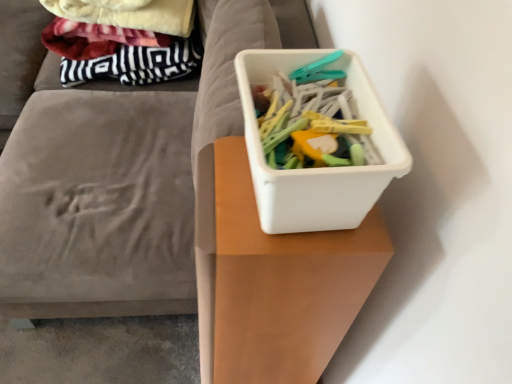
Identify the location of white plastic container at center. (118, 182).

The height and width of the screenshot is (384, 512). Describe the element at coordinates (283, 283) in the screenshot. I see `white plastic container at upper right` at that location.

Locate an element on the screen. The width and height of the screenshot is (512, 384). white plastic container at center is located at coordinates (118, 182).

How many degrees apart are the facing directions of white plastic container at center and white plastic container at center?

The angular difference between white plastic container at center and white plastic container at center is 0.000945 degrees.

Consider the image. Considering the relative positions of white plastic container at center and white plastic container at center in the image provided, is white plastic container at center to the left of white plastic container at center from the viewer's perspective?

In fact, white plastic container at center is to the right of white plastic container at center.

Looking at this image, from a real-world perspective, who is located higher, white plastic container at center or white plastic container at center?

white plastic container at center, from a real-world perspective.

Image resolution: width=512 pixels, height=384 pixels. Find the location of `furniture above the white plastic container at center (from the image's perspective)`. furniture above the white plastic container at center (from the image's perspective) is located at coordinates (118, 182).

Is white plastic container at center shorter than white plastic container at upper right?

Indeed, white plastic container at center has a lesser height compared to white plastic container at upper right.

You are a GUI agent. You are given a task and a screenshot of the screen. Output one action in this format:
    pyautogui.click(x=<x>, y=<y>)
    Task: Click on the table that appears above the white plastic container at center (from a real-world perspective)
    The width and height of the screenshot is (512, 384).
    Given the screenshot: What is the action you would take?
    pyautogui.click(x=283, y=283)

How many degrees apart are the facing directions of white plastic container at center and white plastic container at upper right?

The facing directions of white plastic container at center and white plastic container at upper right are 0.0007 degrees apart.

In the image, is white plastic container at center positioned in front of or behind white plastic container at upper right?

In the image, white plastic container at center appears behind white plastic container at upper right.

Which is nearer, (387, 244) or (288, 38)?

The point (387, 244) is in front.

What are the coordinates of `furniture above the white plastic container at upper right (from the image's perspective)` in the screenshot? It's located at (118, 182).

Between white plastic container at upper right and white plastic container at center, which one has less height?

Standing shorter between the two is white plastic container at center.

Considering the positions of objects white plastic container at upper right and white plastic container at center in the image provided, who is more to the left, white plastic container at upper right or white plastic container at center?

Result: white plastic container at center.

Between white plastic container at center and white plastic container at upper right, which one has larger size?

white plastic container at upper right is bigger.

Is white plastic container at center positioned with its back to white plastic container at upper right?

No, white plastic container at center is not facing away from white plastic container at upper right.

Does point (236, 62) lie behind point (248, 306)?

No.

Which of these two, white plastic container at center or white plastic container at upper right, is wider?

white plastic container at upper right is wider.

Considering the relative sizes of white plastic container at center and white plastic container at center in the image provided, is white plastic container at center wider than white plastic container at center?

Yes.

Is white plastic container at center with white plastic container at center?

No.

From a real-world perspective, who is located higher, white plastic container at center or white plastic container at center?

white plastic container at center.

From a real-world perspective, who is located lower, white plastic container at upper right or white plastic container at center?

white plastic container at upper right is physically lower.

Find the location of `storage box in front of the white plastic container at upper right`. storage box in front of the white plastic container at upper right is located at coordinates (317, 168).

Does white plastic container at upper right appear on the left side of white plastic container at center?

Yes.

Looking at the image, does white plastic container at upper right seem bigger or smaller compared to white plastic container at center?

white plastic container at upper right is bigger than white plastic container at center.

You are a GUI agent. You are given a task and a screenshot of the screen. Output one action in this format:
    pyautogui.click(x=<x>, y=<y>)
    Task: Click on the storage box lying on the right of white plastic container at center
    The width and height of the screenshot is (512, 384).
    Given the screenshot: What is the action you would take?
    pyautogui.click(x=317, y=168)

In the image, there is a white plastic container at upper right. Where is `furniture below it (from a real-world perspective)`? This screenshot has height=384, width=512. furniture below it (from a real-world perspective) is located at coordinates (118, 182).

When comparing their distances from white plastic container at center, does white plastic container at center or white plastic container at upper right seem further?

white plastic container at center.

Considering their positions, is white plastic container at center positioned further to white plastic container at upper right than white plastic container at center?

Based on the image, white plastic container at center appears to be further to white plastic container at upper right.

Based on their spatial positions, is white plastic container at upper right or white plastic container at center closer to white plastic container at center?

white plastic container at upper right is closer to white plastic container at center.

Estimate the real-world distances between objects in this image. Which object is closer to white plastic container at upper right, white plastic container at center or white plastic container at center?

Based on the image, white plastic container at center appears to be nearer to white plastic container at upper right.

Estimate the real-world distances between objects in this image. Which object is further from white plastic container at center, white plastic container at upper right or white plastic container at center?

The object further to white plastic container at center is white plastic container at center.

Looking at the image, which one is located closer to white plastic container at center, white plastic container at center or white plastic container at upper right?

Based on the image, white plastic container at upper right appears to be nearer to white plastic container at center.

At what (x,y) coordinates should I click in order to perform the action: click on storage box between white plastic container at center and white plastic container at upper right in the up-down direction. Please return your answer as a coordinate pair (x, y). The width and height of the screenshot is (512, 384). Looking at the image, I should click on (x=317, y=168).